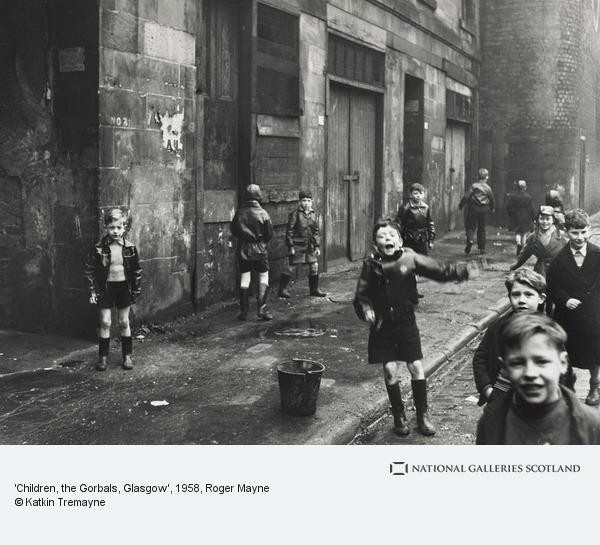
This screenshot has width=600, height=545. I want to click on small black trashcan, so click(316, 392).